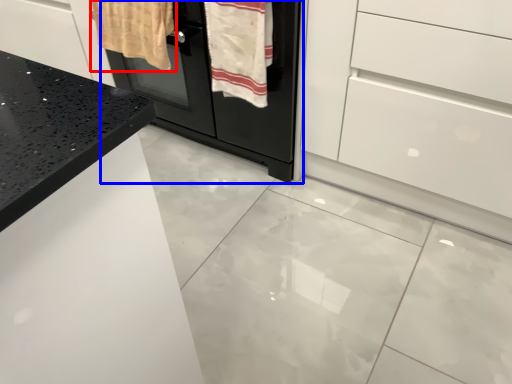
Question: Which object is further to the camera taking this photo, bath towel (highlighted by a red box) or oven (highlighted by a blue box)?

Choices:
 (A) bath towel
 (B) oven

Answer: (A)